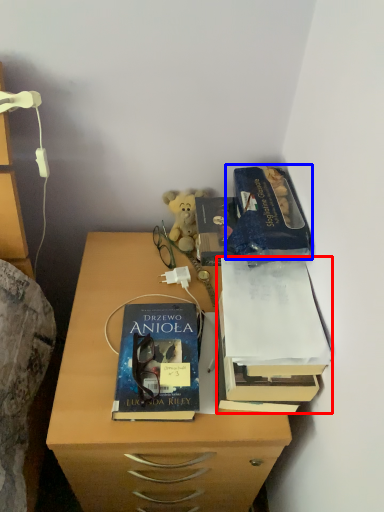
Question: Which point is closer to the camera, book (highlighted by a red box) or paperback book (highlighted by a blue box)?

Choices:
 (A) book
 (B) paperback book

Answer: (A)